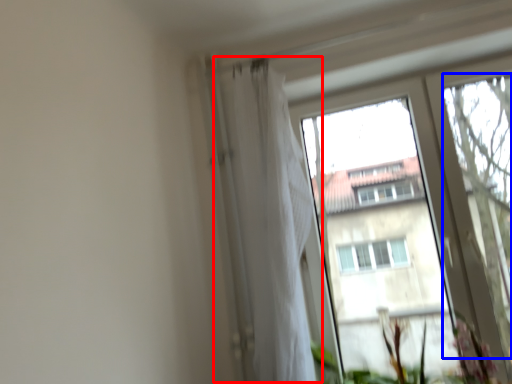
Question: Among these objects, which one is farthest to the camera, shower curtain (highlighted by a red box) or tree (highlighted by a blue box)?

Choices:
 (A) shower curtain
 (B) tree

Answer: (B)